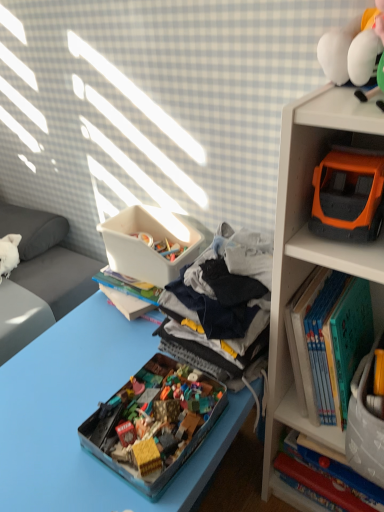
Question: Does translucent plastic toy box at center have a greater height compared to white plastic container at center?

Choices:
 (A) yes
 (B) no

Answer: (B)

Question: Is translucent plastic toy box at center to the left of white plastic container at center from the viewer's perspective?

Choices:
 (A) yes
 (B) no

Answer: (B)

Question: Is translucent plastic toy box at center facing away from white plastic container at center?

Choices:
 (A) no
 (B) yes

Answer: (A)

Question: Can you confirm if translucent plastic toy box at center is wider than white plastic container at center?

Choices:
 (A) no
 (B) yes

Answer: (B)

Question: Are translucent plastic toy box at center and white plastic container at center far apart?

Choices:
 (A) yes
 (B) no

Answer: (B)

Question: Relative to orange plastic toy truck at upper right, is hardcover book at right, placed as the second book when sorted from top to bottom, in front or behind?

Choices:
 (A) front
 (B) behind

Answer: (B)

Question: Looking at their shapes, would you say hardcover book at right, placed as the second book when sorted from top to bottom, is wider or thinner than orange plastic toy truck at upper right?

Choices:
 (A) thin
 (B) wide

Answer: (A)

Question: In terms of height, does hardcover book at right, marked as the first book in a bottom-to-top arrangement, look taller or shorter compared to orange plastic toy truck at upper right?

Choices:
 (A) short
 (B) tall

Answer: (B)

Question: From a real-world perspective, relative to orange plastic toy truck at upper right, is hardcover book at right, placed as the second book when sorted from top to bottom, vertically above or below?

Choices:
 (A) above
 (B) below

Answer: (B)

Question: Is point [132, 239] positioned closer to the camera than point [327, 287]?

Choices:
 (A) farther
 (B) closer

Answer: (A)

Question: Is white plastic container at center inside the boundaries of hardcover book at upper right, the first book positioned from the top, or outside?

Choices:
 (A) outside
 (B) inside

Answer: (A)

Question: In terms of height, does white plastic container at center look taller or shorter compared to hardcover book at upper right, the first book positioned from the top?

Choices:
 (A) tall
 (B) short

Answer: (B)

Question: Considering the relative positions of white plastic container at center and hardcover book at upper right, placed as the second book when sorted from bottom to top, in the image provided, is white plastic container at center to the left or to the right of hardcover book at upper right, placed as the second book when sorted from bottom to top,?

Choices:
 (A) right
 (B) left

Answer: (B)

Question: Based on their positions, is translucent plastic toy box at center located to the left or right of blue plastic tray at center?

Choices:
 (A) right
 (B) left

Answer: (A)

Question: Is translucent plastic toy box at center spatially inside blue plastic tray at center, or outside of it?

Choices:
 (A) inside
 (B) outside

Answer: (B)